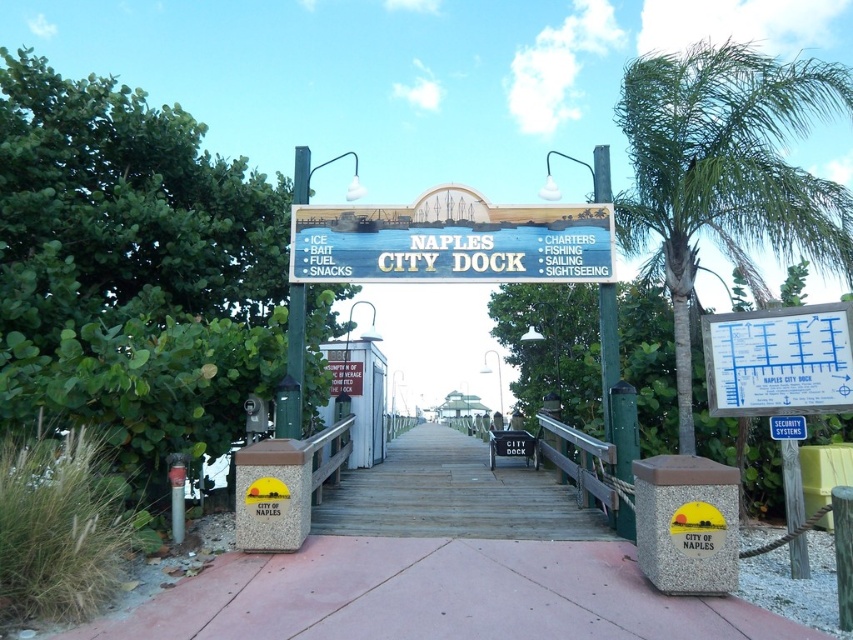
In the scene shown: You are standing at Naples City Dock and need to find the snack bar. You see a white paper map at right and a green wooden signpost at center. According to the map, where is the snack bar located relative to the signpost?

The white paper map at right indicates that the snack bar is located to the north of the green wooden signpost at center.

You are standing at the Naples City Dock entrance and want to know how far you are from the point marked at coordinates (743,321). Can you determine the distance?

The point at coordinates (743,321) is 19.85 feet away from you.